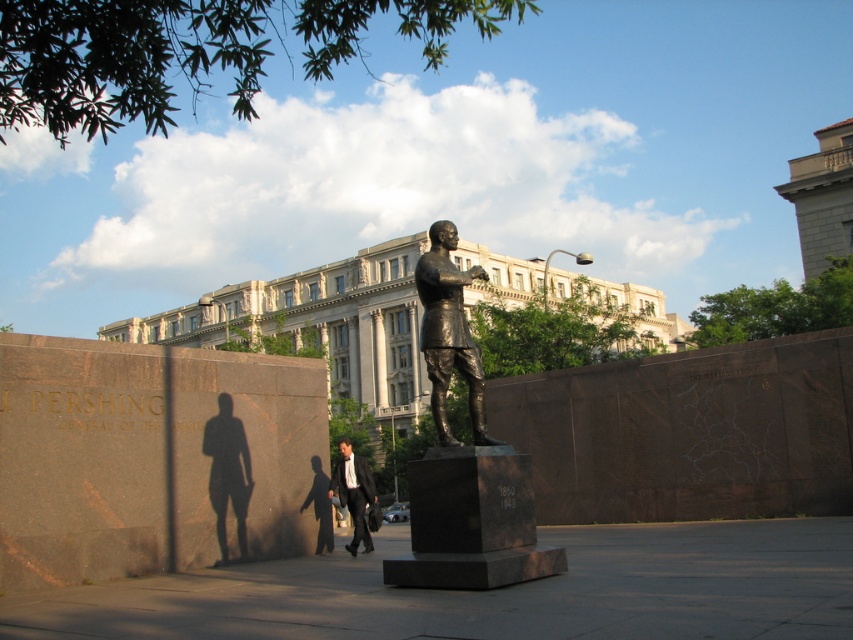
You are a photographer trying to capture both the shiny bronze statue at center and the black suit at center in a single frame. Since you want to ensure both are clearly visible, which object should you focus on first to account for their size difference?

The shiny bronze statue at center is taller than the black suit at center, so you should focus on the statue first to ensure its details are captured clearly before adjusting for the smaller black suit at center.

You are a historian visiting the statue of General John J. Pershing. You notice two objects in the image. The bronze statue at center and the black suit at center. Which object is higher in the image?

The bronze statue at center is positioned over black suit at center, so the bronze statue at center is higher.